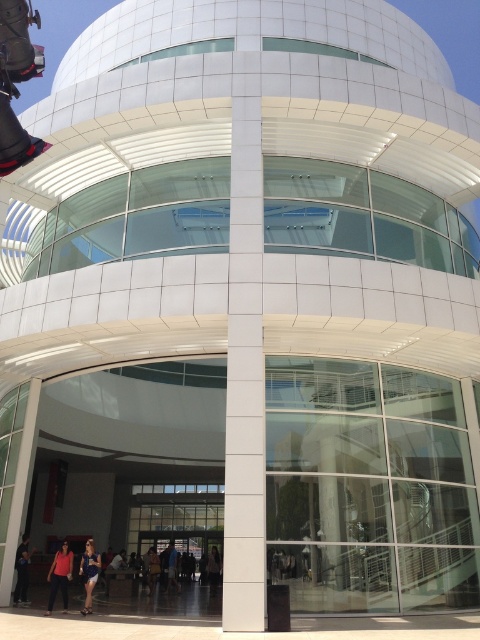
Which is above, matte red shirt at lower left or blue denim shorts at lower left?

blue denim shorts at lower left is higher up.

Between point (63, 568) and point (92, 556), which one is positioned in front?

Point (63, 568) is more forward.

Identify the location of matte red shirt at lower left. (60, 577).

In the scene shown: Between matte red shirt at lower left and dark blue jeans at lower left, which one has more height?

matte red shirt at lower left

Is matte red shirt at lower left positioned before dark blue jeans at lower left?

Yes, it is.

The image size is (480, 640). What are the coordinates of `matte red shirt at lower left` in the screenshot? It's located at (60, 577).

Does point (17, 588) lie behind point (213, 586)?

That is False.

Between dark blue jeans at lower left and dark brown leather jacket at center, which one appears on the left side from the viewer's perspective?

dark blue jeans at lower left is more to the left.

This screenshot has height=640, width=480. Describe the element at coordinates (22, 570) in the screenshot. I see `dark blue jeans at lower left` at that location.

You are a GUI agent. You are given a task and a screenshot of the screen. Output one action in this format:
    pyautogui.click(x=<x>, y=<y>)
    Task: Click on the dark blue jeans at lower left
    
    Given the screenshot: What is the action you would take?
    coord(22,570)